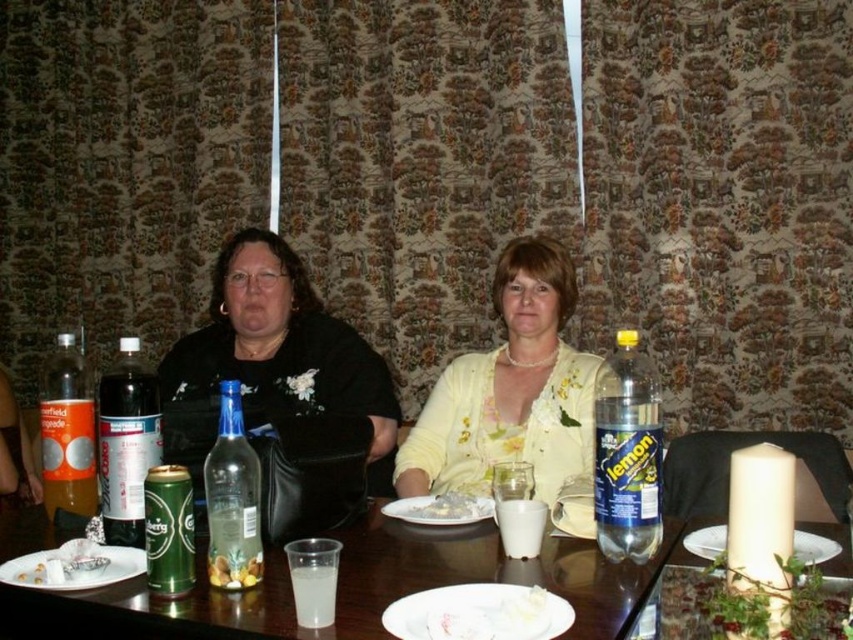
Question: Which point is farther to the camera?

Choices:
 (A) black fabric at center
 (B) white ceramic plate at lower right

Answer: (A)

Question: Does yellow satin blouse at center appear over white ceramic plate at lower left?

Choices:
 (A) yes
 (B) no

Answer: (A)

Question: Is dark brown glass bottle at left positioned before translucent plastic cup at table center?

Choices:
 (A) no
 (B) yes

Answer: (A)

Question: Estimate the real-world distances between objects in this image. Which object is closer to the clear glass bottle at center?

Choices:
 (A) white ceramic plate at lower left
 (B) dark brown glass bottle at left

Answer: (A)

Question: Which point is farther to the camera?

Choices:
 (A) (57, 460)
 (B) (102, 509)
 (C) (386, 509)

Answer: (C)

Question: Does black fabric at center appear under white creamy dessert at plate center?

Choices:
 (A) no
 (B) yes

Answer: (A)